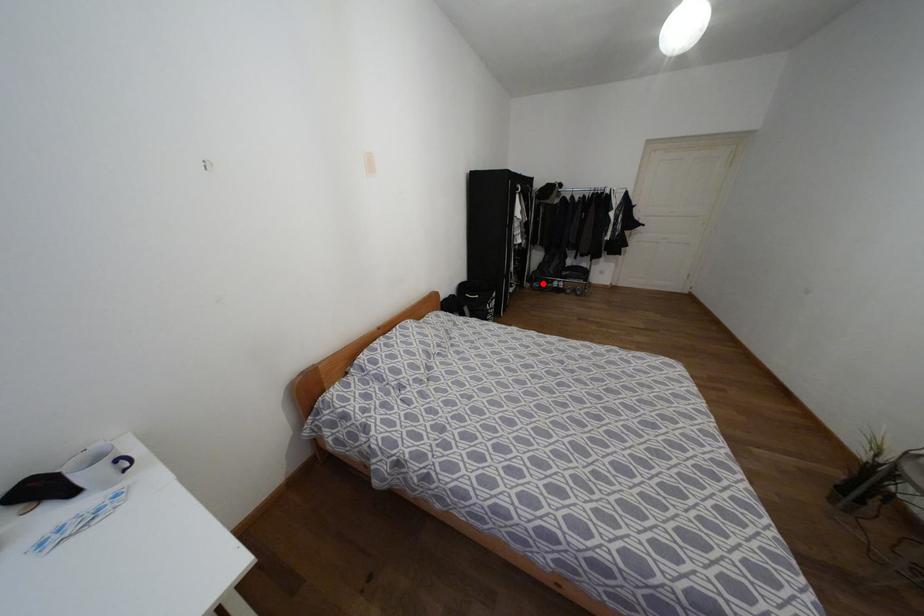
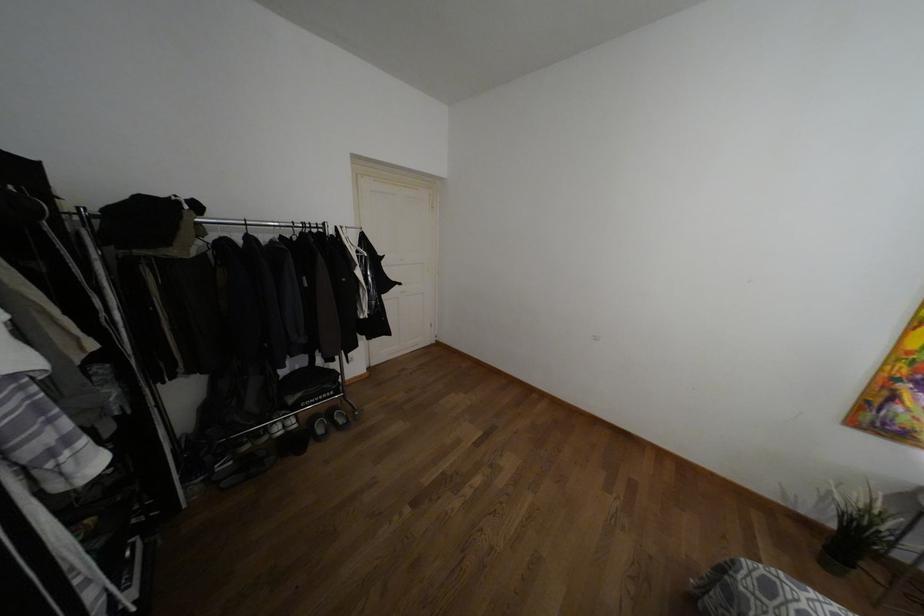
The point at the highlighted location is marked in the first image. Where is the corresponding point in the second image?

(246, 447)